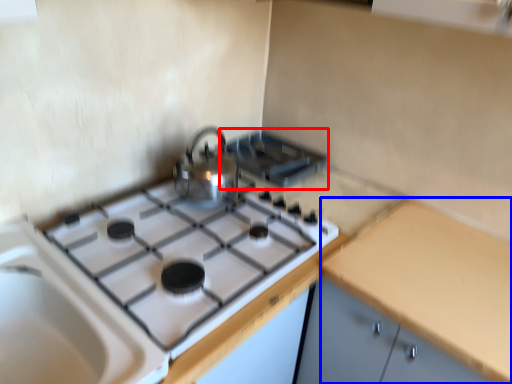
Question: Which of the following is the farthest to the observer, appliance (highlighted by a red box) or counter top (highlighted by a blue box)?

Choices:
 (A) appliance
 (B) counter top

Answer: (A)